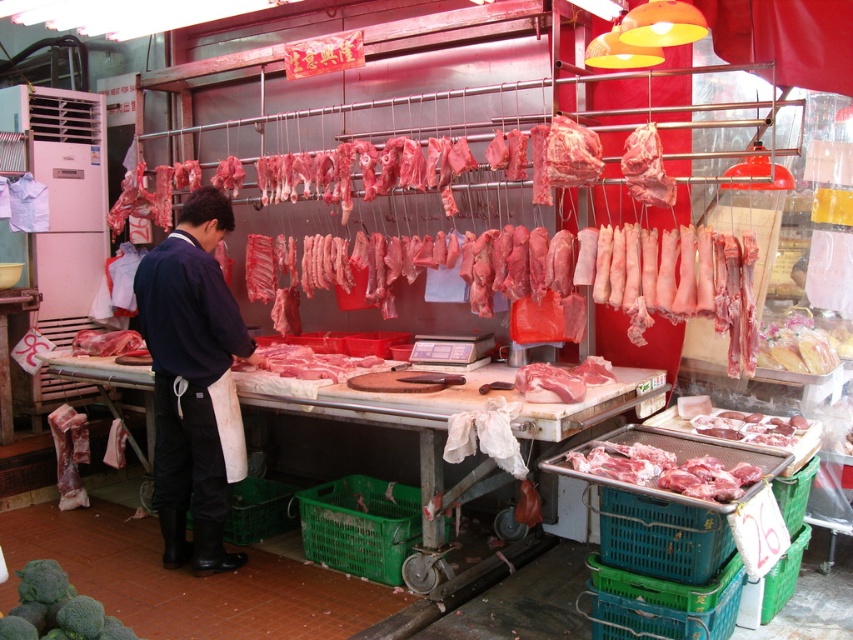
You are a delivery person carrying a 4 meter long box. You need to pass through the space between the two points marked as point (178, 440). Will the box fit through the space?

The two points marked as point (178, 440) are 3.92 meters apart. Since the box is 4 meters long, it is slightly longer than the available space. Therefore, the box will not fit through the space between the two points marked as point (178, 440).

In the scene shown: You are a customer at the meat market stall and want to pick up an item located at point (x=625, y=458) and another item at point (x=828, y=337). Which item will you reach first?

You will reach the item at point (x=625, y=458) first because it is closer to you than the item at point (x=828, y=337).